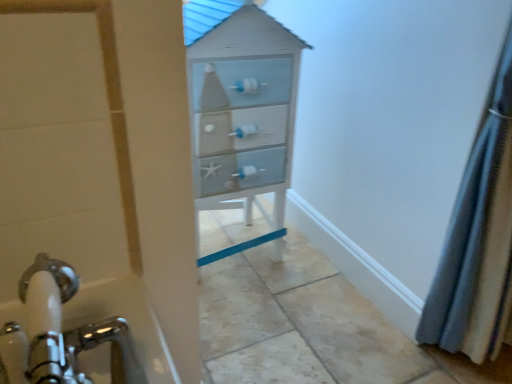
The image size is (512, 384). Find the location of `vacant space in gray fabric shower curtain at right (from a real-world perspective)`. vacant space in gray fabric shower curtain at right (from a real-world perspective) is located at coordinates (454, 366).